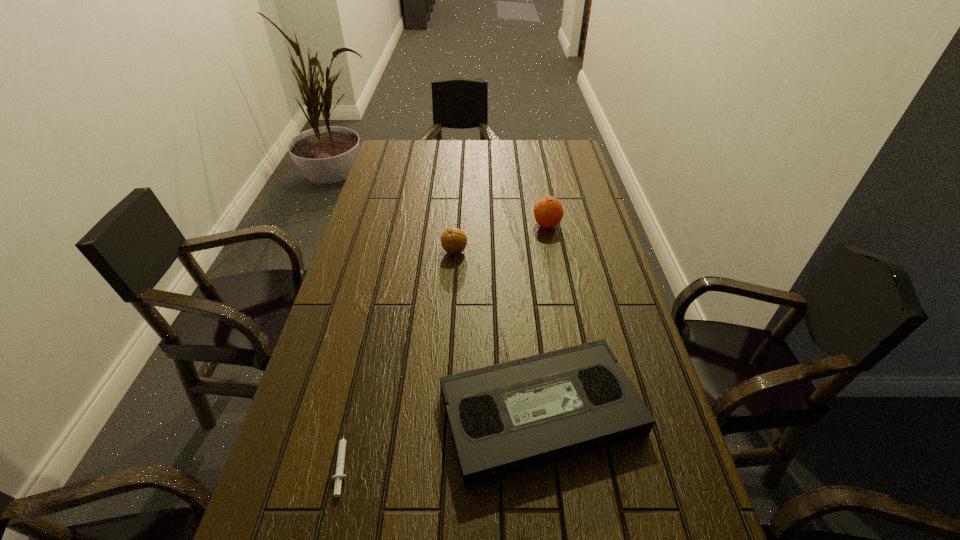
Find the location of a particular element. The image size is (960, 540). the tallest object is located at coordinates (548, 211).

Locate an element on the screen. The height and width of the screenshot is (540, 960). the right orange is located at coordinates (548, 211).

Find the location of a particular element. This screenshot has height=540, width=960. the left orange is located at coordinates (453, 240).

You are a GUI agent. You are given a task and a screenshot of the screen. Output one action in this format:
    pyautogui.click(x=<x>, y=<y>)
    Task: Click on the second farthest object
    This screenshot has width=960, height=540.
    Given the screenshot: What is the action you would take?
    pyautogui.click(x=453, y=240)

What are the coordinates of `the second shortest object` in the screenshot? It's located at (505, 418).

Identify the location of syringe. (339, 475).

In order to click on the shortest object in this screenshot , I will do `click(339, 475)`.

This screenshot has height=540, width=960. Find the location of `free location located 0.390m on the left of the tallest object`. free location located 0.390m on the left of the tallest object is located at coordinates (417, 225).

In order to click on free space located 0.280m on the left of the shorter orange in this screenshot , I will do `click(352, 251)`.

Locate an element on the screen. vacant area situated 0.150m on the left of the second shortest object is located at coordinates (372, 412).